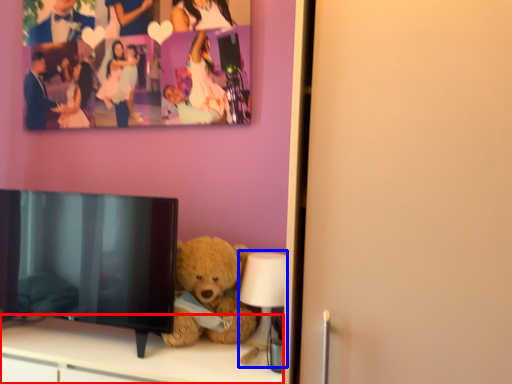
Question: Which of the following is the closest to the observer, furniture (highlighted by a red box) or lamp (highlighted by a blue box)?

Choices:
 (A) furniture
 (B) lamp

Answer: (A)